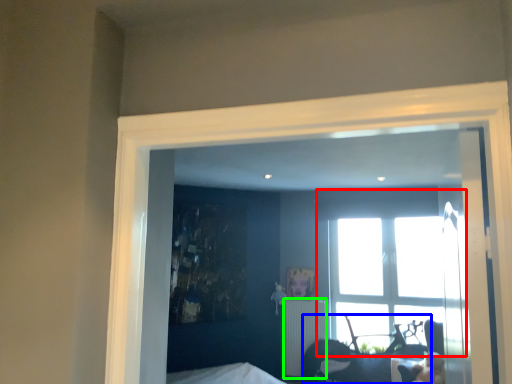
Question: Which object is the closest to the window (highlighted by a red box)? Choose among these: furniture (highlighted by a blue box) or radiator (highlighted by a green box).

Choices:
 (A) furniture
 (B) radiator

Answer: (A)